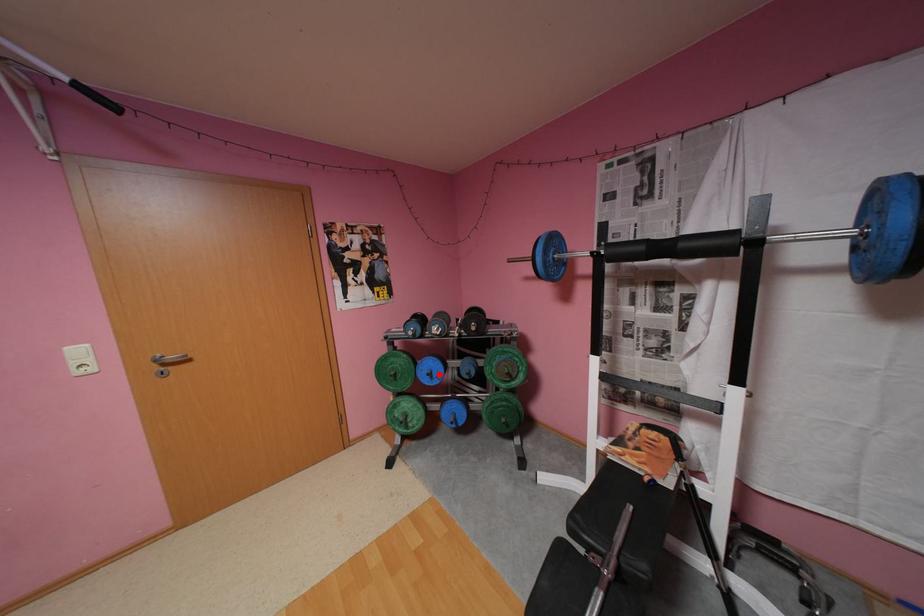
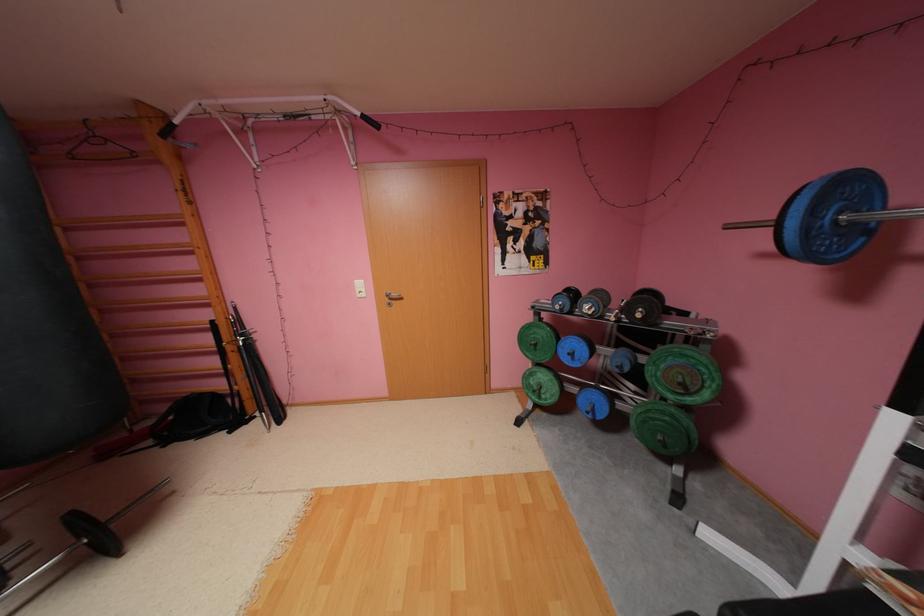
Question: I am providing you with two images of the same scene from different viewpoints. In image1, a red point is highlighted. Considering the same 3D point in image2, which of the following is correct?

Choices:
 (A) It is closer
 (B) It is farther

Answer: (B)